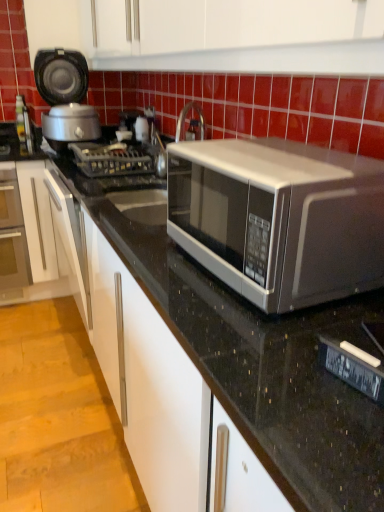
Question: Are metallic gray gas stove at center and matte glass oven at left located far from each other?

Choices:
 (A) yes
 (B) no

Answer: (B)

Question: Does metallic gray gas stove at center come behind matte glass oven at left?

Choices:
 (A) yes
 (B) no

Answer: (B)

Question: Considering the relative sizes of metallic gray gas stove at center and matte glass oven at left in the image provided, is metallic gray gas stove at center wider than matte glass oven at left?

Choices:
 (A) yes
 (B) no

Answer: (B)

Question: Is metallic gray gas stove at center positioned beyond the bounds of matte glass oven at left?

Choices:
 (A) yes
 (B) no

Answer: (A)

Question: From the image's perspective, is metallic gray gas stove at center beneath matte glass oven at left?

Choices:
 (A) no
 (B) yes

Answer: (A)

Question: Is metallic gray gas stove at center smaller than matte glass oven at left?

Choices:
 (A) yes
 (B) no

Answer: (A)

Question: Can you confirm if satin silver microwave at center is smaller than matte black rice cooker at left?

Choices:
 (A) yes
 (B) no

Answer: (A)

Question: Is satin silver microwave at center not within matte black rice cooker at left?

Choices:
 (A) yes
 (B) no

Answer: (A)

Question: Considering the relative positions of satin silver microwave at center and matte black rice cooker at left in the image provided, is satin silver microwave at center to the right of matte black rice cooker at left from the viewer's perspective?

Choices:
 (A) no
 (B) yes

Answer: (B)

Question: Is satin silver microwave at center not near matte black rice cooker at left?

Choices:
 (A) no
 (B) yes

Answer: (B)

Question: From the image's perspective, is satin silver microwave at center on matte black rice cooker at left?

Choices:
 (A) yes
 (B) no

Answer: (B)

Question: Could you tell me if satin silver microwave at center is facing matte black rice cooker at left?

Choices:
 (A) yes
 (B) no

Answer: (B)

Question: Is the depth of matte black rice cooker at left less than that of satin silver microwave at center?

Choices:
 (A) yes
 (B) no

Answer: (B)